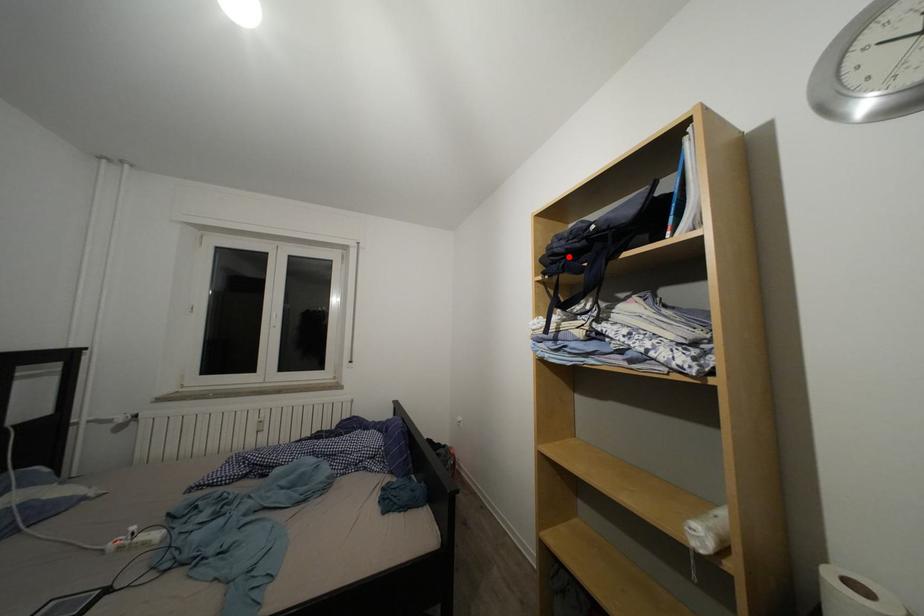
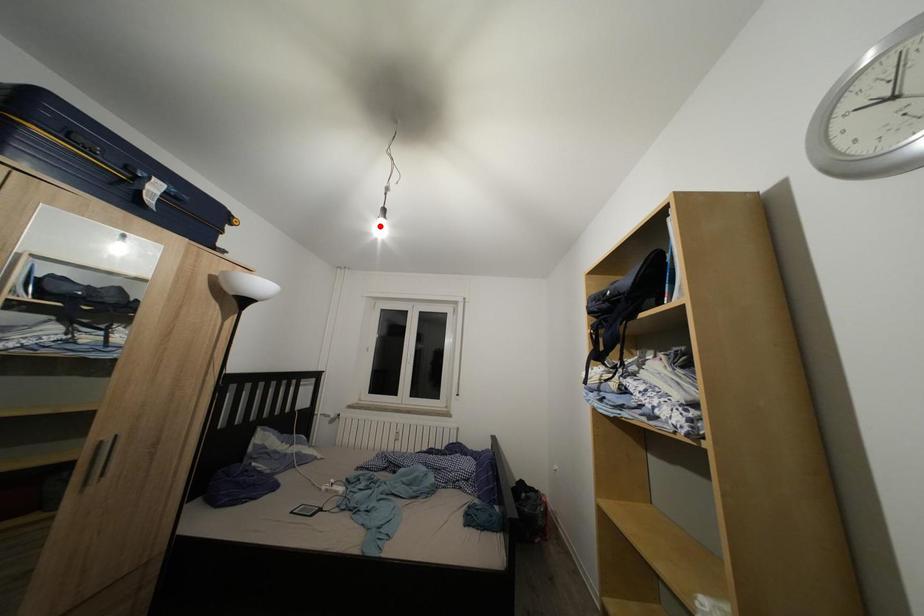
I am providing you with two images of the same scene from different viewpoints. A red point is marked on the first image and another point is marked on the second image. Does the point marked in image1 correspond to the same location as the one in image2?

No